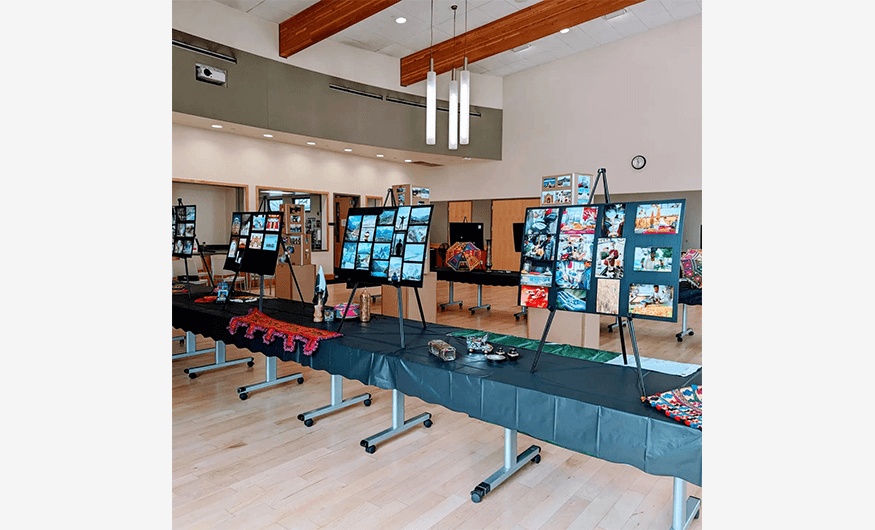
Where is `ceiling`? The height and width of the screenshot is (530, 875). ceiling is located at coordinates (411, 4).